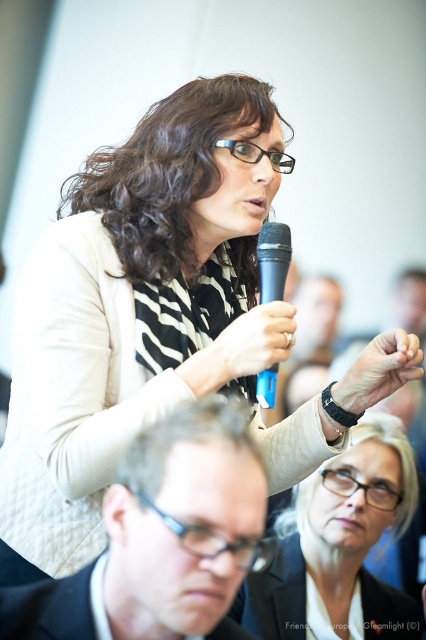
You are a speaker at an event and need to choose between the white matte microphone at center and the black plastic microphone at center. Which one is closer to your hand if your hand is placed exactly between them?

Both microphones are at the same distance from your hand since they are positioned symmetrically around the center point, being 8.01 centimeters apart.

You are attending a conference and notice two items at the center of the speaker. Which item is shorter between the black leather wristwatch at center and the black plastic microphone at center?

The black leather wristwatch at center is shorter than the black plastic microphone at center.

You are attending a conference and want to take a photo of the speaker and the audience. The speaker is at point (276, 312) and the audience is at point (377, 339). Which point should you focus on to ensure both are in focus?

Point (276, 312) is closer to the camera than point (377, 339). To ensure both the speaker and the audience are in focus, you should focus on the point closer to the camera, which is point (276, 312).